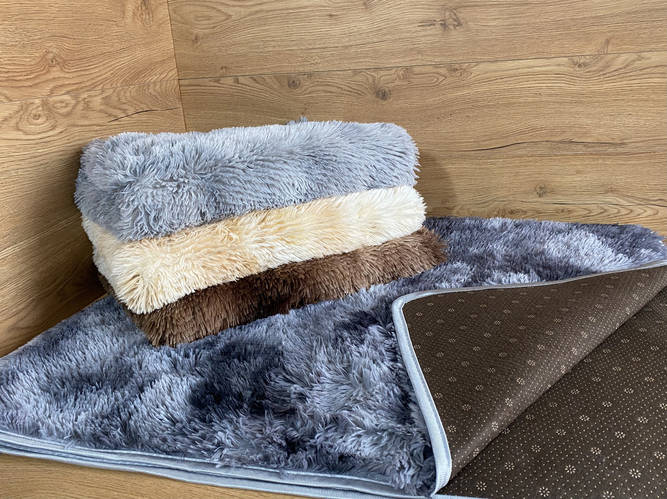
Identify the location of towel. (275, 288).